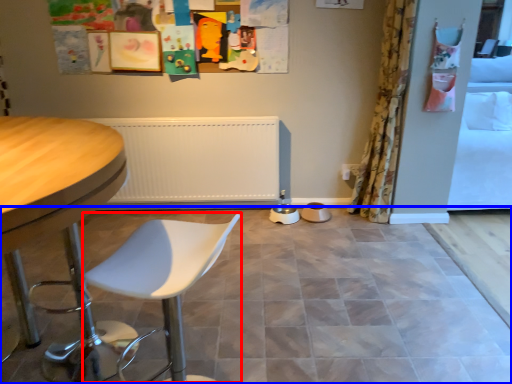
Question: Which object is further to the camera taking this photo, swivel chair (highlighted by a red box) or ceramic tile (highlighted by a blue box)?

Choices:
 (A) swivel chair
 (B) ceramic tile

Answer: (B)